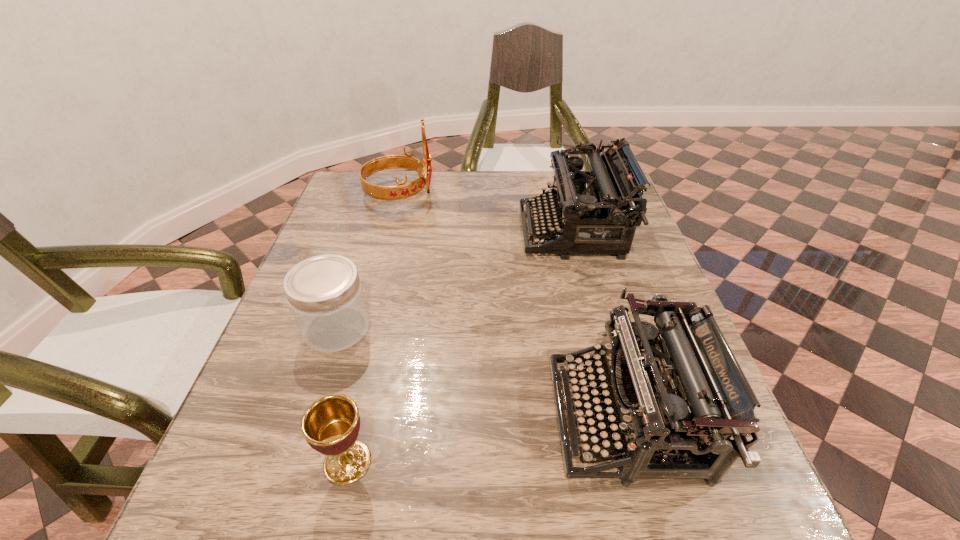
The width and height of the screenshot is (960, 540). I want to click on free spot between the third tallest object and the tiara, so click(513, 306).

At what (x,y) coordinates should I click in order to perform the action: click on vacant space in between the chalice and the shorter typewriter. Please return your answer as a coordinate pair (x, y). Looking at the image, I should click on (487, 440).

Locate an element on the screen. vacant point located between the chalice and the tiara is located at coordinates (373, 328).

This screenshot has width=960, height=540. I want to click on free point between the shorter typewriter and the jar, so click(x=481, y=373).

Where is `free space between the jar and the shorter typewriter`? free space between the jar and the shorter typewriter is located at coordinates (481, 373).

Where is `free space between the taller typewriter and the chalice`? Image resolution: width=960 pixels, height=540 pixels. free space between the taller typewriter and the chalice is located at coordinates (460, 347).

Where is `vacant area between the farther typewriter and the third shortest object`? vacant area between the farther typewriter and the third shortest object is located at coordinates (599, 325).

This screenshot has width=960, height=540. Find the location of `free space between the jar and the tiara`. free space between the jar and the tiara is located at coordinates (369, 261).

Locate an element on the screen. The image size is (960, 540). vacant area that lies between the third tallest object and the jar is located at coordinates (481, 373).

Point out which object is positioned as the nearest to the nearer typewriter. Please provide its 2D coordinates. Your answer should be formatted as a tuple, i.e. [(x, y)], where the tuple contains the x and y coordinates of a point satisfying the conditions above.

[(592, 210)]